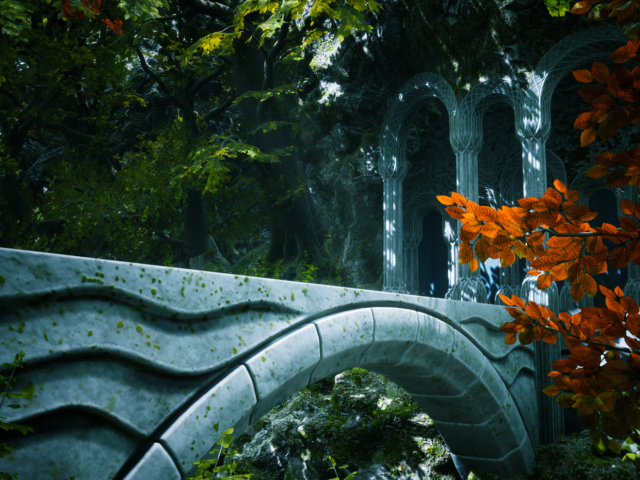
Find the location of `under arch`. under arch is located at coordinates (322, 434).